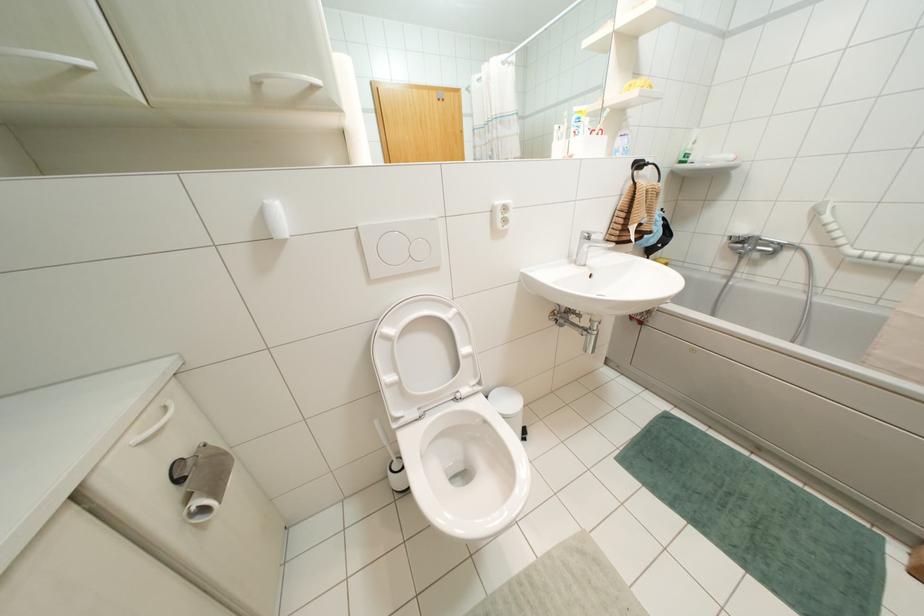
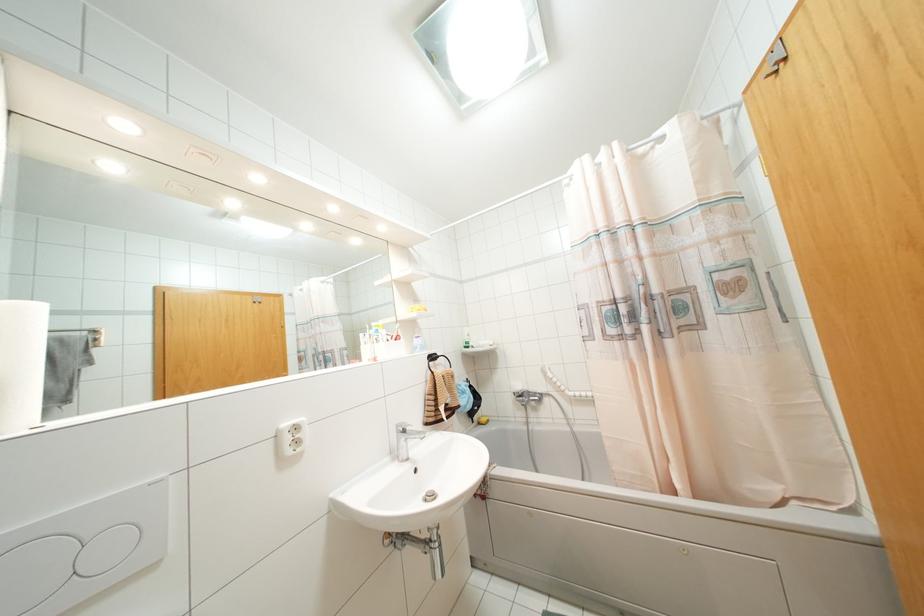
Where in the second image is the point corresponding to point 589,238 from the first image?

(404, 431)